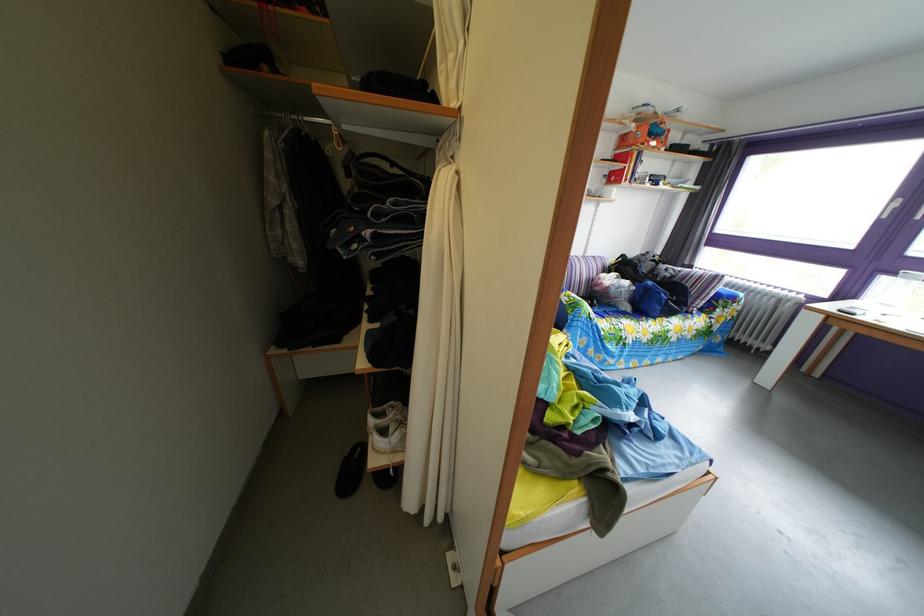
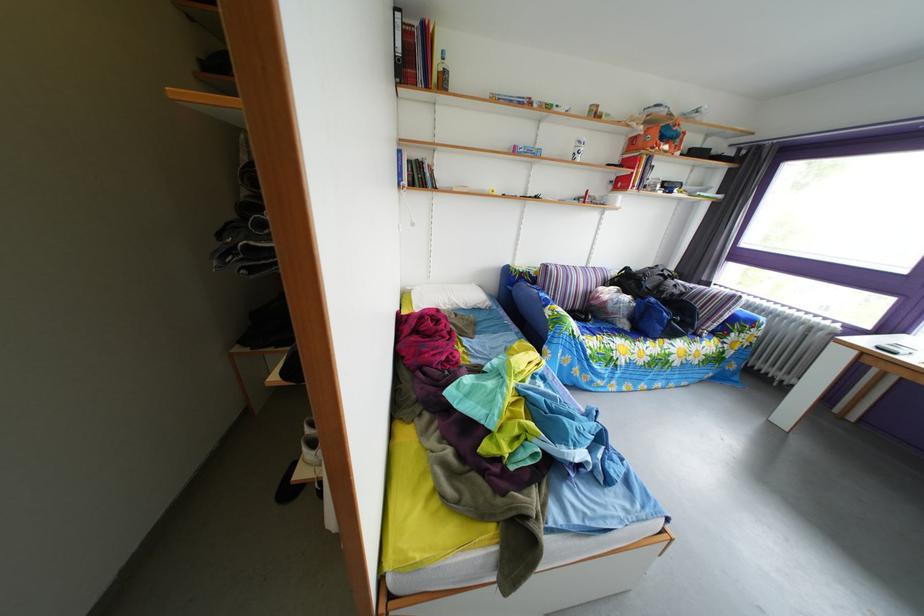
The point at (661, 144) is marked in the first image. Where is the corresponding point in the second image?

(673, 147)